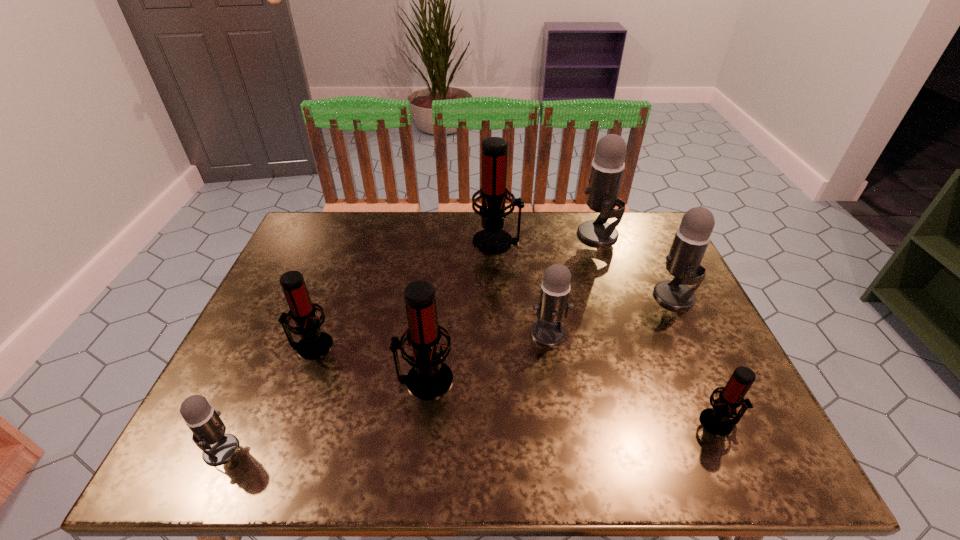
I want to click on the farthest red microphone, so click(493, 193).

The image size is (960, 540). Identify the location of the biggest red microphone. (493, 193).

What are the coordinates of `the second gray microphone from right to left` in the screenshot? It's located at (608, 165).

Locate an element on the screen. the sixth object from left to right is located at coordinates tap(608, 165).

You are a GUI agent. You are given a task and a screenshot of the screen. Output one action in this format:
    pyautogui.click(x=<x>, y=<y>)
    Task: Click on the third farthest object
    
    Given the screenshot: What is the action you would take?
    pyautogui.click(x=692, y=237)

Where is `the sixth nearest microphone`? The width and height of the screenshot is (960, 540). the sixth nearest microphone is located at coordinates (692, 237).

This screenshot has width=960, height=540. I want to click on the sixth farthest microphone, so click(x=429, y=378).

Where is `the third smallest red microphone`? Image resolution: width=960 pixels, height=540 pixels. the third smallest red microphone is located at coordinates (429, 378).

Locate an element on the screen. the seventh microphone from right to left is located at coordinates (314, 344).

This screenshot has width=960, height=540. I want to click on the second farthest red microphone, so coord(314,344).